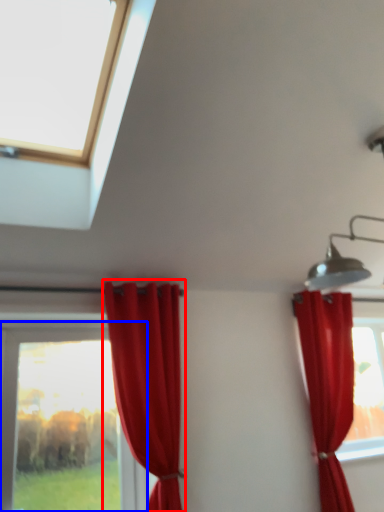
Question: Which object is further to the camera taking this photo, curtain (highlighted by a red box) or window (highlighted by a blue box)?

Choices:
 (A) curtain
 (B) window

Answer: (B)